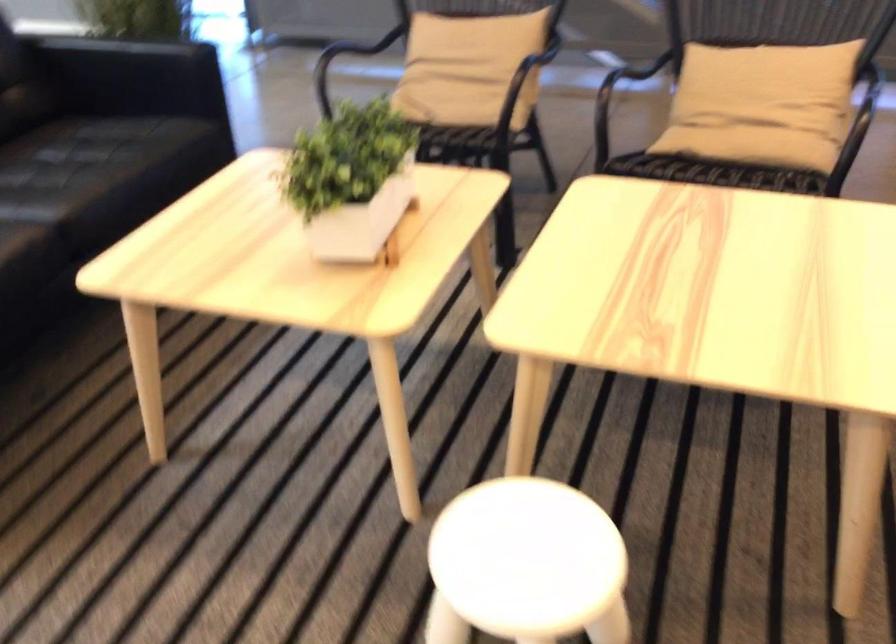
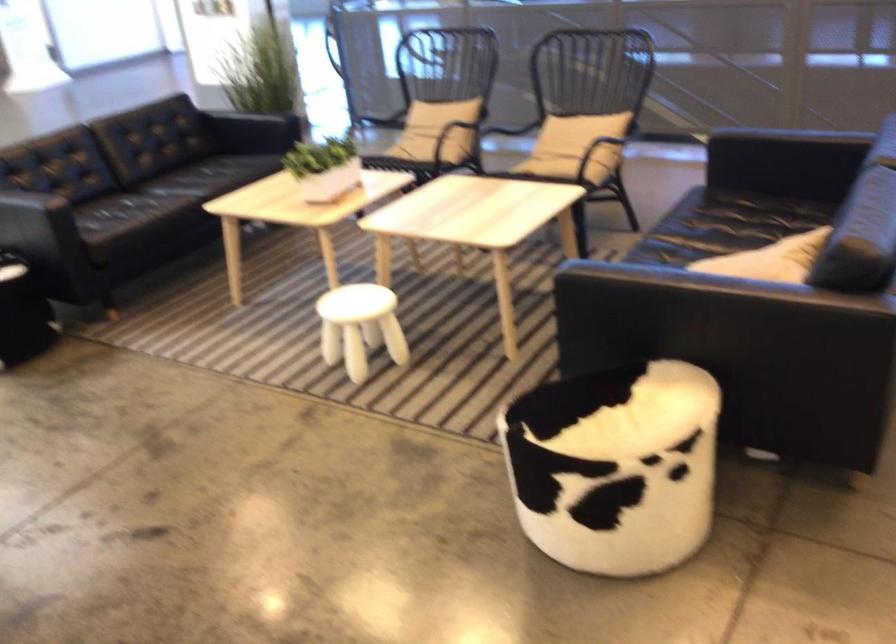
The point at (765, 145) is marked in the first image. Where is the corresponding point in the second image?

(552, 160)